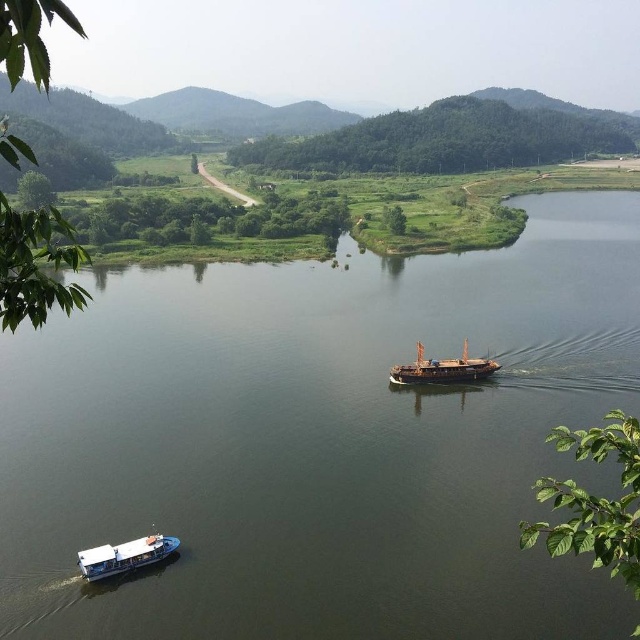
Question: Which object is farther from the camera taking this photo?

Choices:
 (A) wooden ship at center
 (B) green grassy river at center
 (C) white matte boat at lower left

Answer: (A)

Question: Can you confirm if green grassy river at center is wider than wooden ship at center?

Choices:
 (A) no
 (B) yes

Answer: (B)

Question: Which point is farther to the camera?

Choices:
 (A) white matte boat at lower left
 (B) green grassy river at center
 (C) wooden ship at center

Answer: (C)

Question: From the image, what is the correct spatial relationship of white matte boat at lower left in relation to wooden ship at center?

Choices:
 (A) above
 (B) below

Answer: (B)

Question: Based on their relative distances, which object is farther from the green grassy river at center?

Choices:
 (A) white matte boat at lower left
 (B) wooden ship at center

Answer: (A)

Question: Can you confirm if green grassy river at center is bigger than white matte boat at lower left?

Choices:
 (A) no
 (B) yes

Answer: (B)